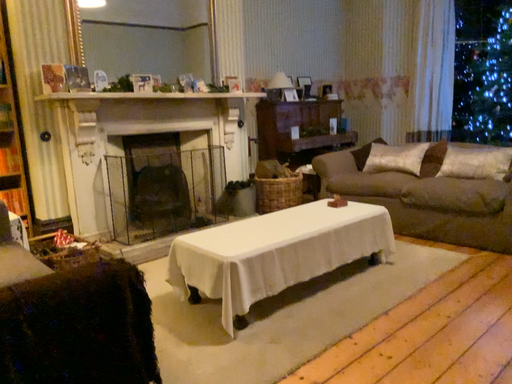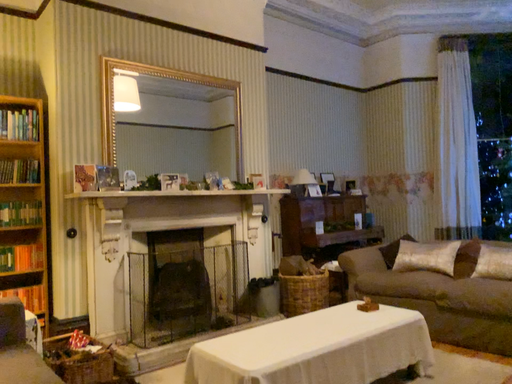
Question: Which way did the camera rotate in the video?

Choices:
 (A) rotated downward
 (B) rotated upward

Answer: (B)